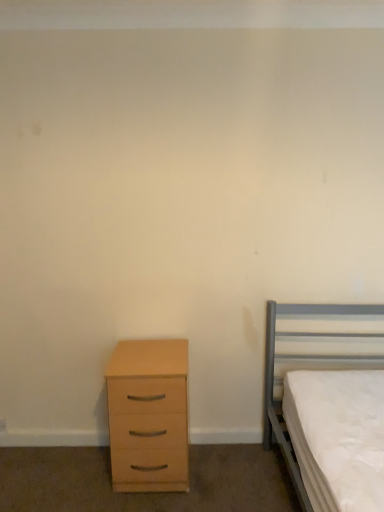
Question: Can you confirm if metallic gray bed at right is smaller than light wood/veneer chest of drawers at lower left?

Choices:
 (A) no
 (B) yes

Answer: (A)

Question: Are metallic gray bed at right and light wood/veneer chest of drawers at lower left beside each other?

Choices:
 (A) no
 (B) yes

Answer: (A)

Question: Is metallic gray bed at right completely or partially outside of light wood/veneer chest of drawers at lower left?

Choices:
 (A) yes
 (B) no

Answer: (A)

Question: Is metallic gray bed at right taller than light wood/veneer chest of drawers at lower left?

Choices:
 (A) no
 (B) yes

Answer: (B)

Question: From a real-world perspective, is metallic gray bed at right below light wood/veneer chest of drawers at lower left?

Choices:
 (A) yes
 (B) no

Answer: (B)

Question: Is metallic gray bed at right facing towards light wood/veneer chest of drawers at lower left?

Choices:
 (A) yes
 (B) no

Answer: (B)

Question: From the image's perspective, is light wood/veneer chest of drawers at lower left located above metallic gray bed at right?

Choices:
 (A) no
 (B) yes

Answer: (A)

Question: Can you confirm if light wood/veneer chest of drawers at lower left is shorter than metallic gray bed at right?

Choices:
 (A) yes
 (B) no

Answer: (A)

Question: Can you confirm if light wood/veneer chest of drawers at lower left is thinner than metallic gray bed at right?

Choices:
 (A) no
 (B) yes

Answer: (B)

Question: Would you say light wood/veneer chest of drawers at lower left is outside metallic gray bed at right?

Choices:
 (A) no
 (B) yes

Answer: (B)

Question: Is light wood/veneer chest of drawers at lower left closer to the viewer compared to metallic gray bed at right?

Choices:
 (A) yes
 (B) no

Answer: (B)

Question: From the image's perspective, is light wood/veneer chest of drawers at lower left under metallic gray bed at right?

Choices:
 (A) yes
 (B) no

Answer: (A)

Question: From a real-world perspective, is light wood/veneer chest of drawers at lower left positioned above or below metallic gray bed at right?

Choices:
 (A) below
 (B) above

Answer: (A)